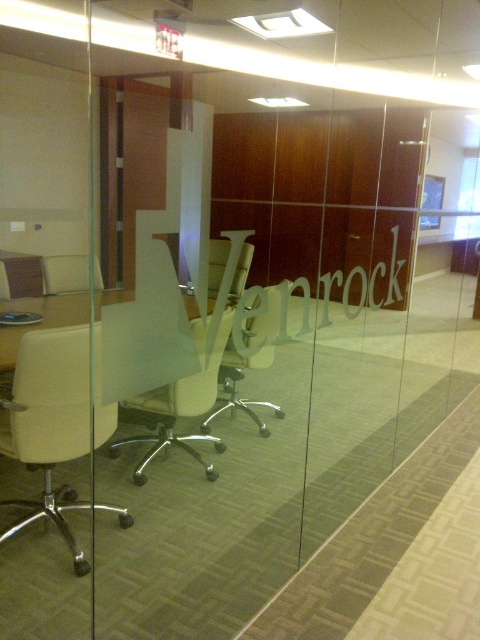
Question: Which object appears farthest from the camera in this image?

Choices:
 (A) white plastic chair at left
 (B) white plastic swivel chair at center
 (C) white leather swivel chair at left

Answer: (B)

Question: Is white plastic chair at center to the left of white plastic chair at left from the viewer's perspective?

Choices:
 (A) yes
 (B) no

Answer: (B)

Question: Which object is closer to the camera taking this photo?

Choices:
 (A) white leather swivel chair at left
 (B) white plastic chair at center

Answer: (A)

Question: From the image, what is the correct spatial relationship of white leather swivel chair at left in relation to matte white office chair at center?

Choices:
 (A) right
 (B) left

Answer: (B)

Question: Which object is farther from the camera taking this photo?

Choices:
 (A) matte white office chair at center
 (B) white plastic chair at left
 (C) white plastic chair at center
 (D) white leather swivel chair at left

Answer: (C)

Question: Does white plastic chair at center come in front of white plastic chair at left?

Choices:
 (A) no
 (B) yes

Answer: (A)